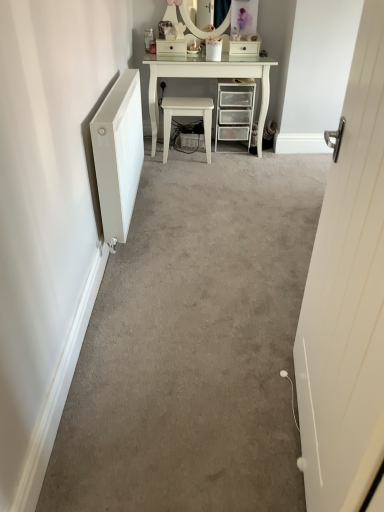
At what (x,y) coordinates should I click in order to perform the action: click on empty space that is ontop of white glossy stool at center (from a real-world perspective). Please return your answer as a coordinate pair (x, y). This screenshot has width=384, height=512. Looking at the image, I should click on (185, 100).